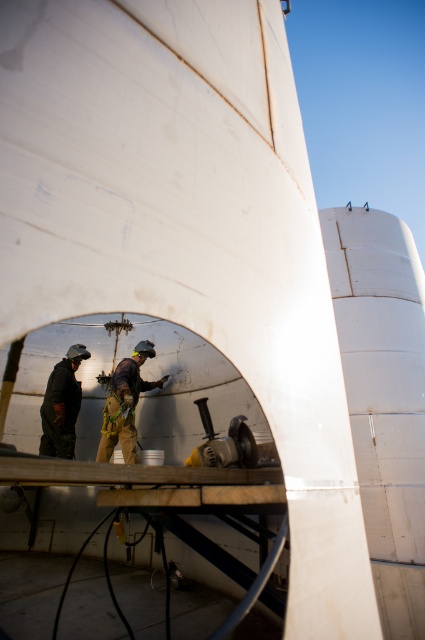
Question: Which of the following is the closest to the observer?

Choices:
 (A) camouflage fabric workwear at center
 (B) dark gray fabric shirt at left
 (C) metallic gray tool at center

Answer: (C)

Question: Is dark gray fabric shirt at left positioned before metallic gray tool at center?

Choices:
 (A) no
 (B) yes

Answer: (A)

Question: Can you confirm if dark gray fabric shirt at left is thinner than metallic gray tool at center?

Choices:
 (A) yes
 (B) no

Answer: (A)

Question: Which object appears closest to the camera in this image?

Choices:
 (A) camouflage fabric workwear at center
 (B) metallic gray tool at center

Answer: (B)

Question: Is camouflage fabric workwear at center thinner than dark gray fabric shirt at left?

Choices:
 (A) no
 (B) yes

Answer: (A)

Question: Which object appears farthest from the camera in this image?

Choices:
 (A) camouflage fabric workwear at center
 (B) metallic gray tool at center

Answer: (A)